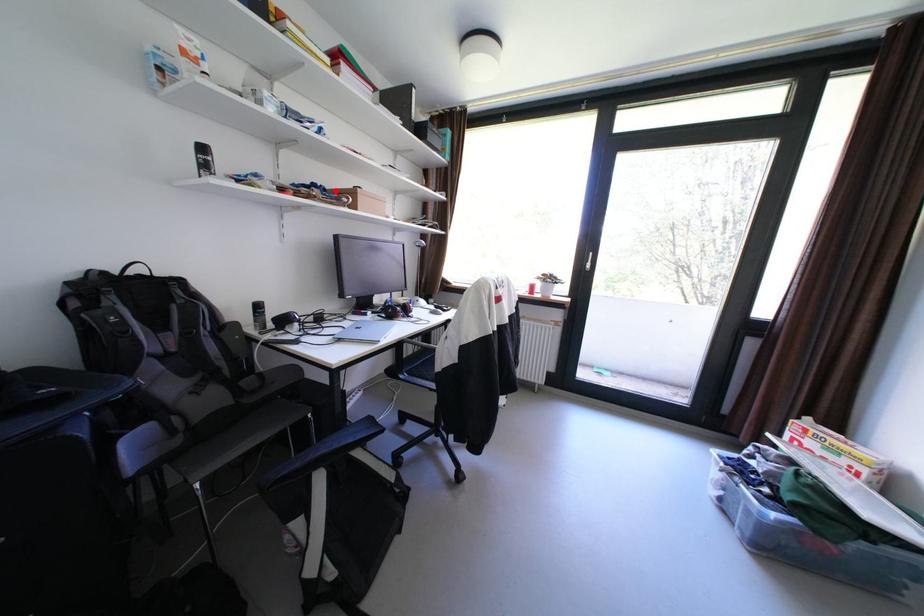
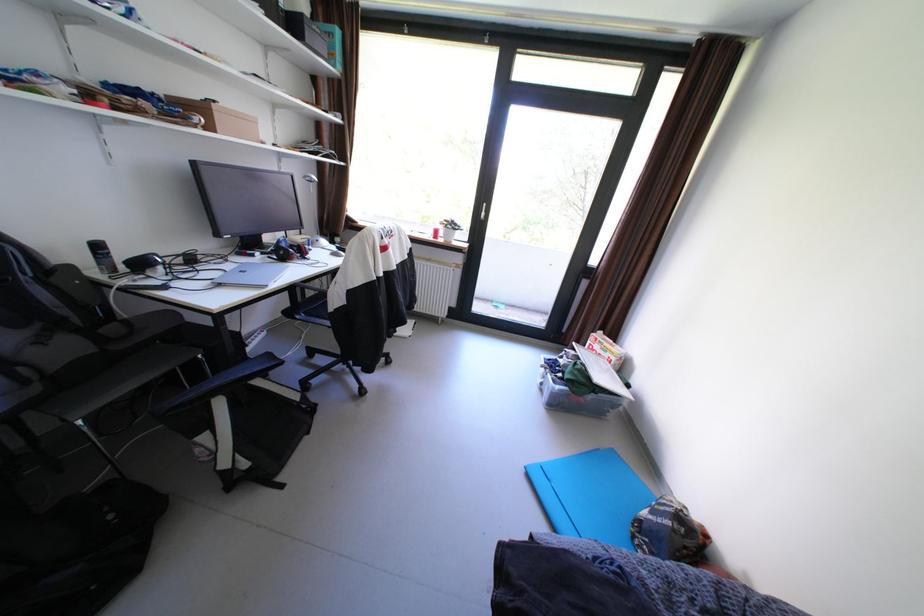
Where in the second image is the point corresponding to the highlighted location from the first image?

(172, 100)